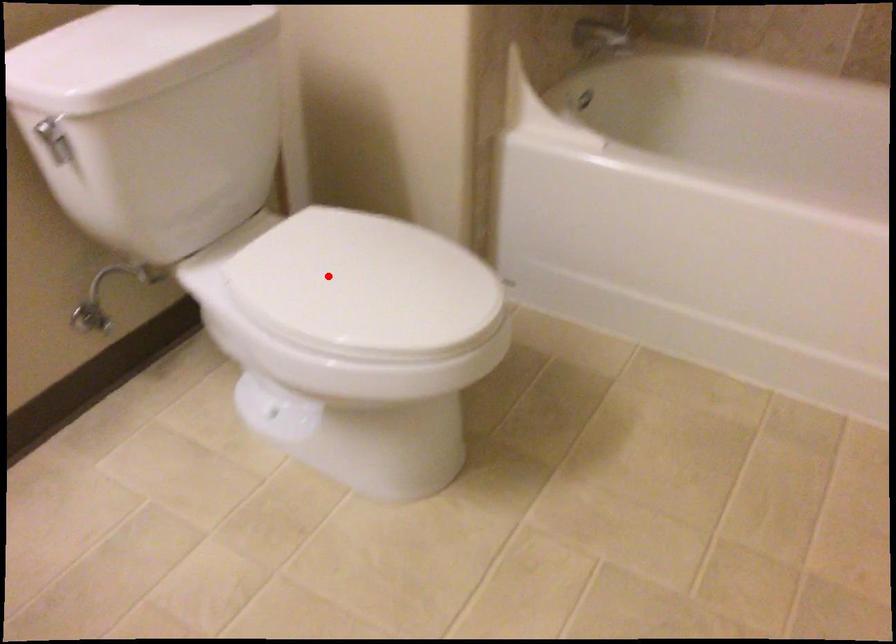
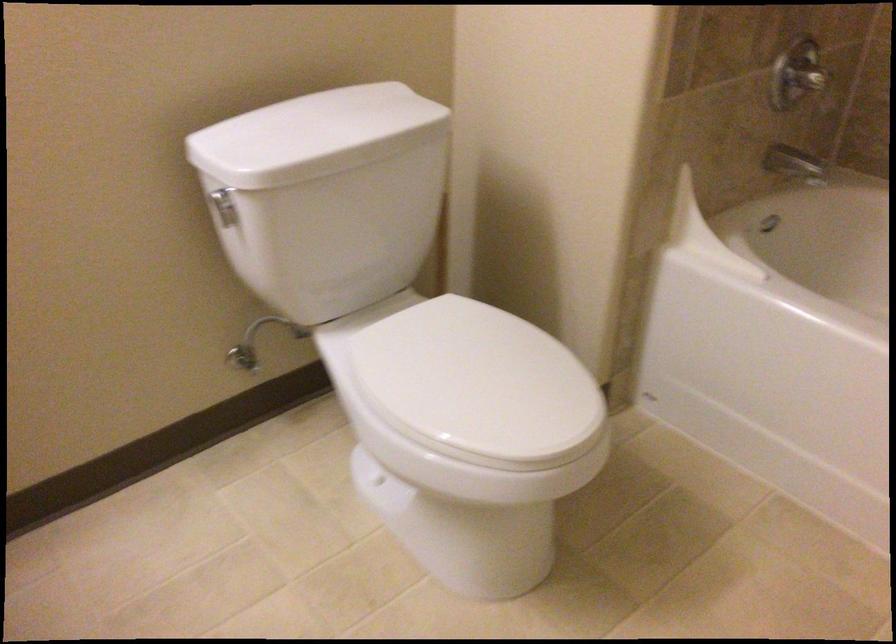
Find the pixel in the second image that matches the highlighted location in the first image.

(442, 363)